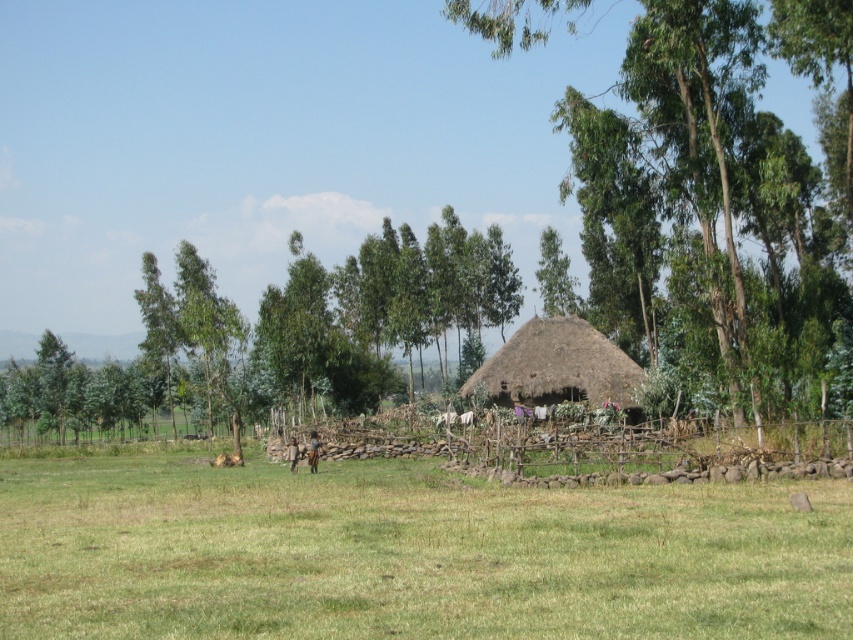
You are standing at the edge of the grassy field and want to walk towards the green leafy tree at center. Based on the coordinates provided, which direction should you head?

The green leafy tree at center is located at point 0.302 on the x and 0.845 on the y. Since the coordinates are relative to the image, you should head towards the center of the image where the tree is positioned.

You are a farmer standing in the middle of the green grassy field at center and want to reach the green leafy tree at center. What do you need to do to get there?

The green leafy tree at center is taller than the green grassy field at center, so you can easily walk towards it as the tree is visible above the grass.